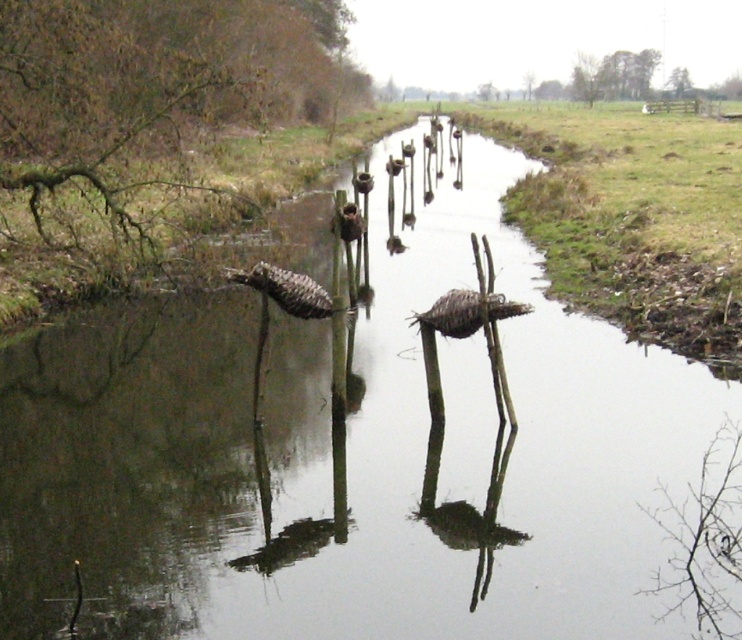
Between point (680, 84) and point (531, 72), which one is positioned in front?

Positioned in front is point (680, 84).

At what (x,y) coordinates should I click in order to perform the action: click on green leafy tree at upper right. Please return your answer as a coordinate pair (x, y). The height and width of the screenshot is (640, 742). Looking at the image, I should click on (677, 83).

Who is lower down, green leafy tree at upper right or green mossy tree at upper center?

Positioned lower is green mossy tree at upper center.

Can you confirm if green leafy tree at upper right is positioned to the right of green mossy tree at upper center?

Correct, you'll find green leafy tree at upper right to the right of green mossy tree at upper center.

The width and height of the screenshot is (742, 640). I want to click on green leafy tree at upper right, so click(677, 83).

Does brown woven basket at left appear over green leafy tree at upper center?

No.

Who is shorter, brown woven basket at left or green leafy tree at upper center?

With less height is green leafy tree at upper center.

This screenshot has height=640, width=742. In order to click on brown woven basket at left in this screenshot , I will do `click(148, 106)`.

Find the location of a particular element. The image size is (742, 640). brown woven basket at left is located at coordinates (148, 106).